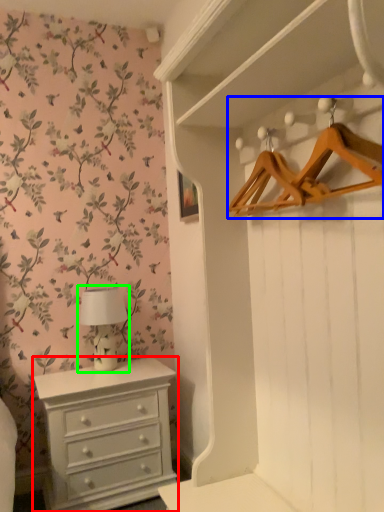
Question: Which object is the closest to the chest of drawers (highlighted by a red box)? Choose among these: hanger (highlighted by a blue box) or table lamp (highlighted by a green box).

Choices:
 (A) hanger
 (B) table lamp

Answer: (B)